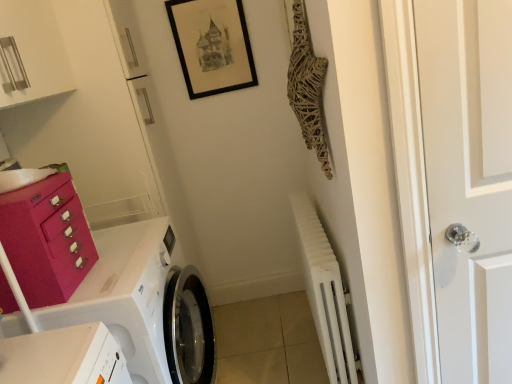
Question: Considering the relative sizes of black matte picture frame at upper center and matte pink drawer at left in the image provided, is black matte picture frame at upper center bigger than matte pink drawer at left?

Choices:
 (A) yes
 (B) no

Answer: (B)

Question: Can you confirm if black matte picture frame at upper center is taller than matte pink drawer at left?

Choices:
 (A) yes
 (B) no

Answer: (A)

Question: Is black matte picture frame at upper center at the left side of matte pink drawer at left?

Choices:
 (A) yes
 (B) no

Answer: (B)

Question: Is black matte picture frame at upper center thinner than matte pink drawer at left?

Choices:
 (A) no
 (B) yes

Answer: (B)

Question: Would you say black matte picture frame at upper center contains matte pink drawer at left?

Choices:
 (A) yes
 (B) no

Answer: (B)

Question: Is black matte picture frame at upper center wider than matte pink drawer at left?

Choices:
 (A) no
 (B) yes

Answer: (A)

Question: From the image's perspective, is matte pink drawer at left over white matte radiator at lower right?

Choices:
 (A) yes
 (B) no

Answer: (A)

Question: Is matte pink drawer at left not close to white matte radiator at lower right?

Choices:
 (A) yes
 (B) no

Answer: (B)

Question: From the image's perspective, is matte pink drawer at left below white matte radiator at lower right?

Choices:
 (A) no
 (B) yes

Answer: (A)

Question: Does matte pink drawer at left have a greater height compared to white matte radiator at lower right?

Choices:
 (A) yes
 (B) no

Answer: (B)

Question: Considering the relative sizes of matte pink drawer at left and white matte radiator at lower right in the image provided, is matte pink drawer at left bigger than white matte radiator at lower right?

Choices:
 (A) no
 (B) yes

Answer: (A)

Question: Considering the relative positions of matte pink drawer at left and white matte radiator at lower right in the image provided, is matte pink drawer at left to the right of white matte radiator at lower right from the viewer's perspective?

Choices:
 (A) no
 (B) yes

Answer: (A)

Question: Is white matte radiator at lower right looking in the opposite direction of black matte picture frame at upper center?

Choices:
 (A) no
 (B) yes

Answer: (A)